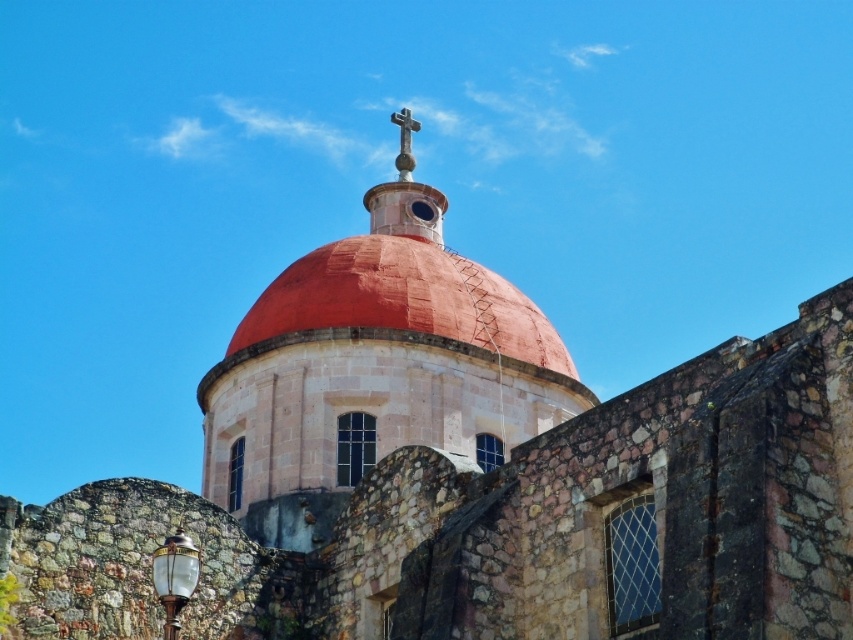
You are an architect analyzing the building. Which object, the smooth terracotta dome at center or the metallic cross at center, is taller?

The smooth terracotta dome at center is taller than the metallic cross at center.

You are an architect designing a model of this building. You have a 10cm wide base for the dome. Can the metallic cross at center fit on top of the smooth terracotta dome at center without exceeding the base width?

The smooth terracotta dome at center is wider than the metallic cross at center, so the cross can fit on top as it is narrower than the dome base.

Based on the scene description, what are the coordinates of the smooth terracotta dome at center?

The smooth terracotta dome at center is located at coordinates (x=374, y=369).